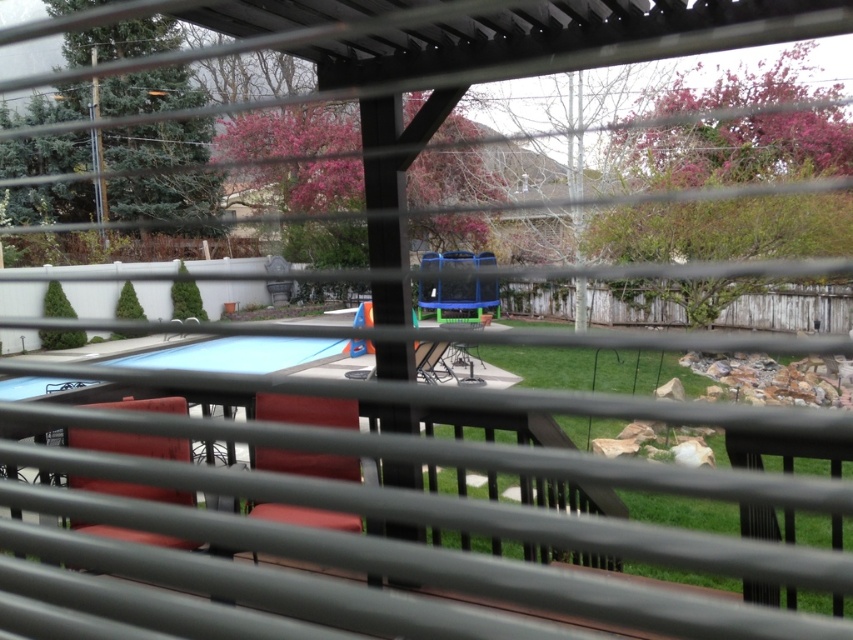
You are standing in a room looking through a window with horizontal slats. You see a velvet red chair at center and a metallic silver table at center in the backyard. Which object is closer to you?

The velvet red chair at center is closer to the viewer than the metallic silver table at center.

You are planning to rearrange the furniture in the backyard. If you want to place a new plant pot between the velvet red chair at left and the metallic silver table at center, which object should you position closer to the middle of the space to accommodate the plant pot?

Since the velvet red chair at left occupies less space than the metallic silver table at center, you should position the metallic silver table at center closer to the middle to create space for the plant pot between them.